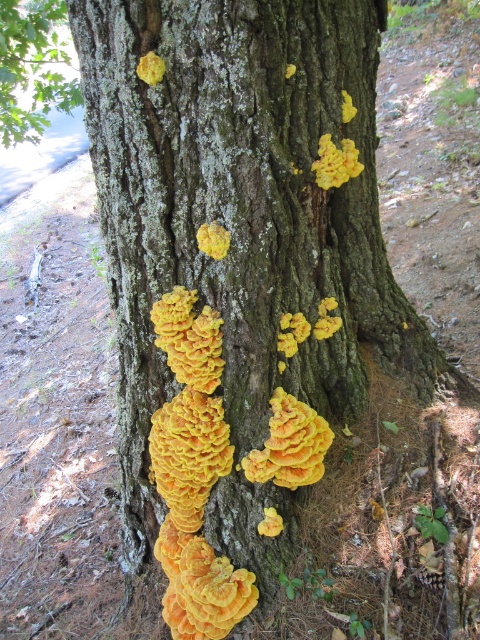
Is yellow crusty fungus at center above yellow sponge-like fungi at center?

Actually, yellow crusty fungus at center is below yellow sponge-like fungi at center.

Does yellow crusty fungus at center have a smaller size compared to yellow sponge-like fungi at center?

No, yellow crusty fungus at center is not smaller than yellow sponge-like fungi at center.

Is point (268, 460) closer to camera compared to point (194, 337)?

No, it is not.

Locate an element on the screen. yellow crusty fungus at center is located at coordinates (289, 444).

Does yellow/orange wood-like fungus at center have a lesser width compared to yellow crusty fungus at upper center?

Incorrect, yellow/orange wood-like fungus at center's width is not less than yellow crusty fungus at upper center's.

Can you confirm if yellow/orange wood-like fungus at center is positioned above yellow crusty fungus at upper center?

No, yellow/orange wood-like fungus at center is not above yellow crusty fungus at upper center.

The image size is (480, 640). I want to click on yellow/orange wood-like fungus at center, so click(201, 586).

Locate an element on the screen. The height and width of the screenshot is (640, 480). yellow/orange wood-like fungus at center is located at coordinates (201, 586).

Between yellow/orange wood-like fungus at center and yellow/orange wood-like at center, which one has more height?

yellow/orange wood-like fungus at center

Can you confirm if yellow/orange wood-like fungus at center is positioned above yellow/orange wood-like at center?

Incorrect, yellow/orange wood-like fungus at center is not positioned above yellow/orange wood-like at center.

Measure the distance between point (162, 529) and camera.

Point (162, 529) is 1.69 meters from camera.

Identify the location of yellow/orange wood-like fungus at center. (201, 586).